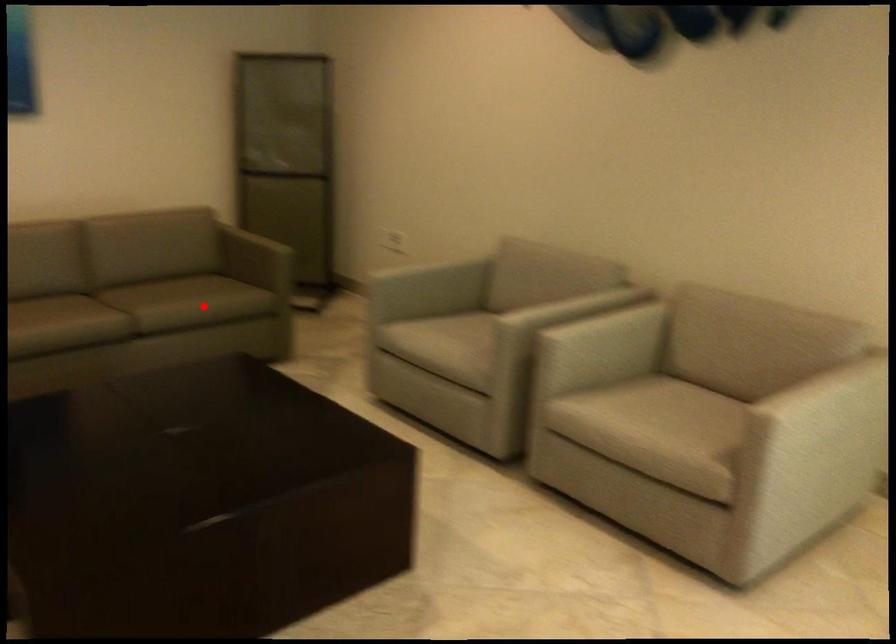
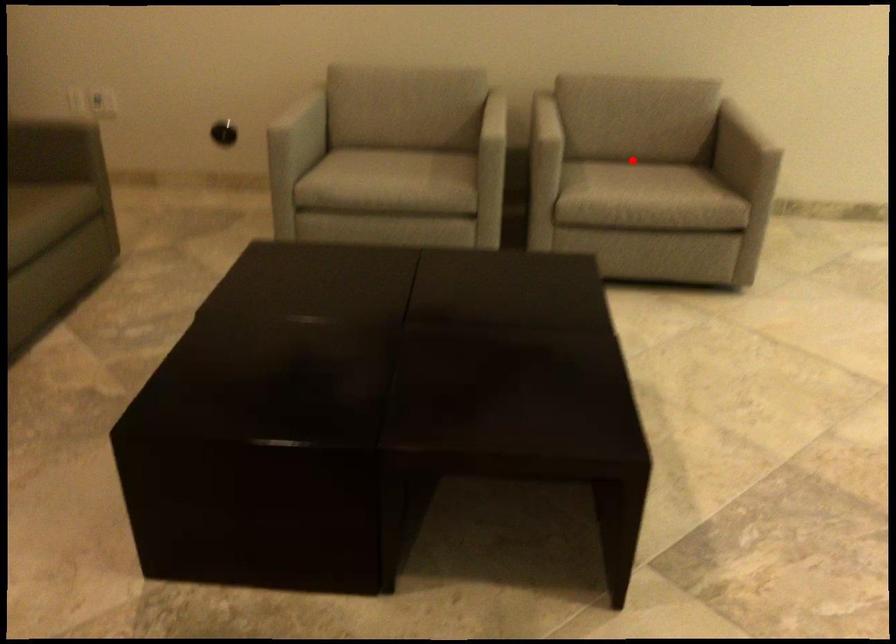
I am providing you with two images of the same scene from different viewpoints. A red point is marked on the first image and another point is marked on the second image. Do the highlighted points in image1 and image2 indicate the same real-world spot?

No